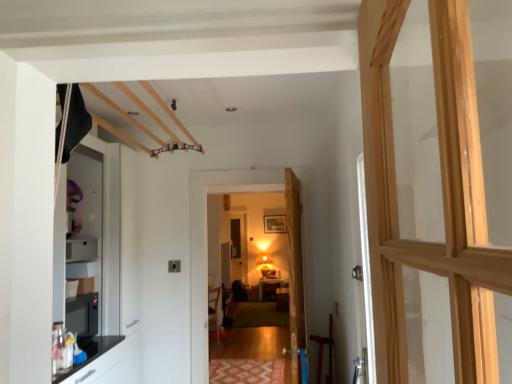
Question: Can you confirm if patterned carpet at center is shorter than wooden door at center, marked as the second door in a back-to-front arrangement?

Choices:
 (A) yes
 (B) no

Answer: (A)

Question: Is patterned carpet at center taller than wooden door at center, marked as the second door in a back-to-front arrangement?

Choices:
 (A) no
 (B) yes

Answer: (A)

Question: Is patterned carpet at center facing away from wooden door at center, the 1th door positioned from the front?

Choices:
 (A) no
 (B) yes

Answer: (A)

Question: Is patterned carpet at center positioned behind wooden door at center, the 1th door positioned from the front?

Choices:
 (A) no
 (B) yes

Answer: (B)

Question: Can you confirm if patterned carpet at center is positioned to the right of wooden door at center, the 1th door positioned from the front?

Choices:
 (A) no
 (B) yes

Answer: (A)

Question: Is patterned carpet at center facing towards wooden door at center, marked as the second door in a back-to-front arrangement?

Choices:
 (A) no
 (B) yes

Answer: (A)

Question: Would you consider wooden door at center, the 1th door positioned from the front, to be distant from matte wooden chair at center?

Choices:
 (A) no
 (B) yes

Answer: (B)

Question: Considering the relative positions of wooden door at center, the 1th door positioned from the front, and matte wooden chair at center in the image provided, is wooden door at center, the 1th door positioned from the front, to the right of matte wooden chair at center from the viewer's perspective?

Choices:
 (A) no
 (B) yes

Answer: (B)

Question: Is wooden door at center, the 1th door positioned from the front, behind matte wooden chair at center?

Choices:
 (A) yes
 (B) no

Answer: (B)

Question: From the image's perspective, is wooden door at center, the 1th door positioned from the front, located above matte wooden chair at center?

Choices:
 (A) yes
 (B) no

Answer: (A)

Question: Is the surface of wooden door at center, the 1th door positioned from the front, in direct contact with matte wooden chair at center?

Choices:
 (A) yes
 (B) no

Answer: (B)

Question: Is wooden door at center, marked as the second door in a back-to-front arrangement, wider than matte wooden chair at center?

Choices:
 (A) yes
 (B) no

Answer: (B)

Question: From a real-world perspective, is matte wooden chair at center on wooden door at center, the 2th door when ordered from front to back?

Choices:
 (A) yes
 (B) no

Answer: (B)